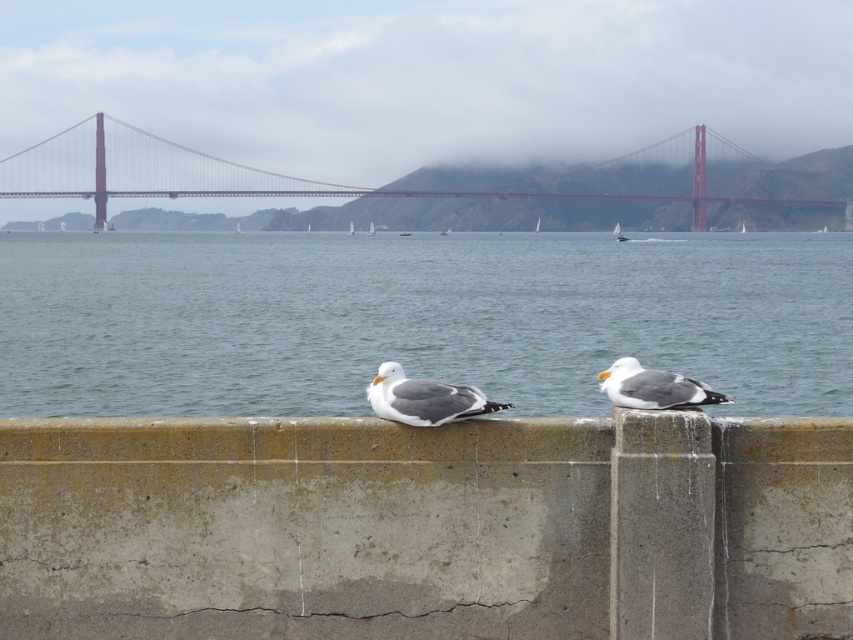
Question: Is red metal bridge at center smaller than gray feathered seagull at center?

Choices:
 (A) yes
 (B) no

Answer: (B)

Question: Considering the real-world distances, which object is farthest from the blue water at center?

Choices:
 (A) white matte seagull at center
 (B) red metal bridge at center
 (C) gray feathered seagull at center

Answer: (C)

Question: Which point is closer to the camera taking this photo?

Choices:
 (A) (633, 403)
 (B) (213, 554)
 (C) (849, 394)

Answer: (B)

Question: Which object is farther from the camera taking this photo?

Choices:
 (A) white matte seagull at center
 (B) blue water at center
 (C) red metal bridge at center
 (D) gray feathered seagull at center

Answer: (C)

Question: Does blue water at center appear over gray feathered seagull at center?

Choices:
 (A) yes
 (B) no

Answer: (A)

Question: Is the position of blue water at center more distant than that of gray feathered seagull at center?

Choices:
 (A) no
 (B) yes

Answer: (B)